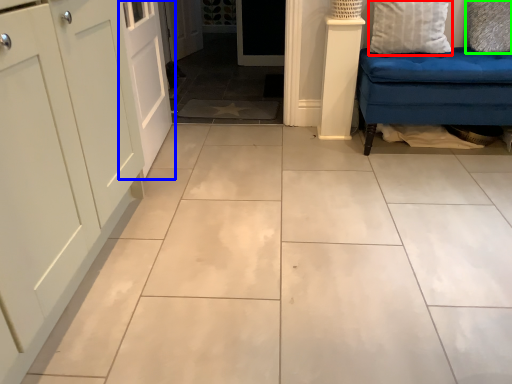
Question: Which object is the closest to the pillow (highlighted by a red box)? Choose among these: door (highlighted by a blue box) or pillow (highlighted by a green box).

Choices:
 (A) door
 (B) pillow

Answer: (B)